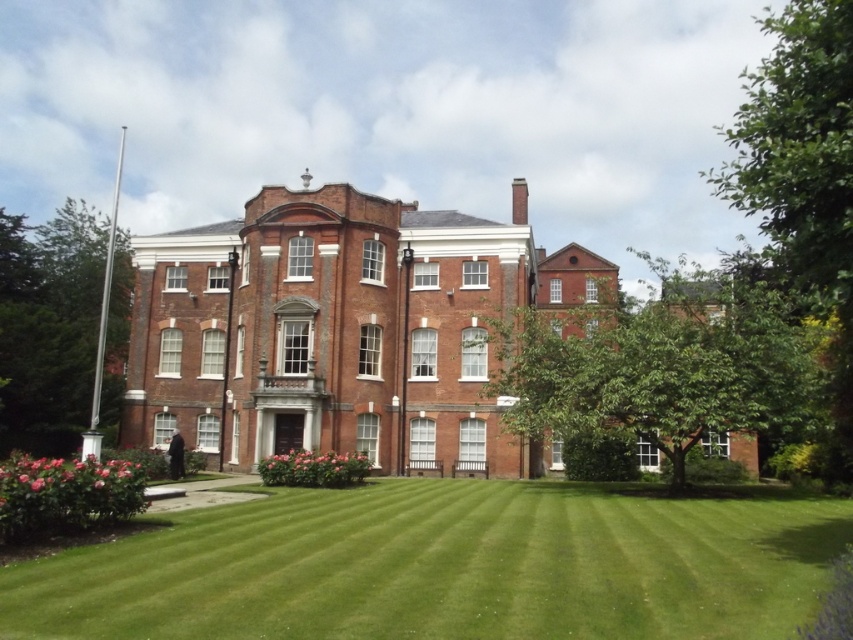
Question: Which object is farther from the camera taking this photo?

Choices:
 (A) green leafy tree at center
 (B) green leafy tree at left
 (C) pink matte flowers at lower center
 (D) brick mansion at center

Answer: (B)

Question: Can you confirm if green leafy tree at center is positioned to the left of green leafy tree at upper right?

Choices:
 (A) yes
 (B) no

Answer: (A)

Question: Is green grass at lower center above pink matte flowers at lower center?

Choices:
 (A) yes
 (B) no

Answer: (B)

Question: Estimate the real-world distances between objects in this image. Which object is farther from the green leafy tree at center?

Choices:
 (A) green grass at lower center
 (B) green leafy tree at left
 (C) green leafy tree at upper right
 (D) pink glossy roses at lower left

Answer: (B)

Question: Which of the following is the closest to the observer?

Choices:
 (A) green grass at lower center
 (B) green leafy tree at upper right
 (C) brick mansion at center
 (D) green leafy tree at center

Answer: (A)

Question: Does brick mansion at center appear over pink matte flowers at lower center?

Choices:
 (A) no
 (B) yes

Answer: (B)